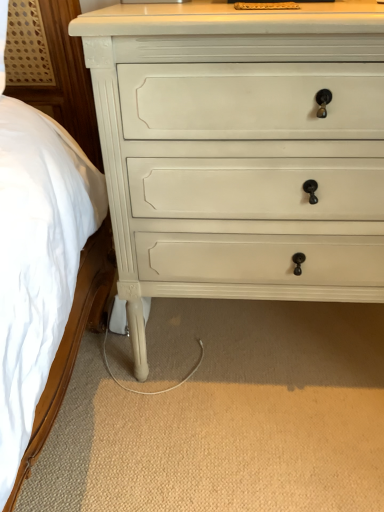
Image resolution: width=384 pixels, height=512 pixels. Find the location of `white painted wood chest of drawers at center`. white painted wood chest of drawers at center is located at coordinates (241, 150).

What do you see at coordinates (241, 150) in the screenshot?
I see `white painted wood chest of drawers at center` at bounding box center [241, 150].

Identify the location of white painted wood chest of drawers at center. This screenshot has height=512, width=384. click(241, 150).